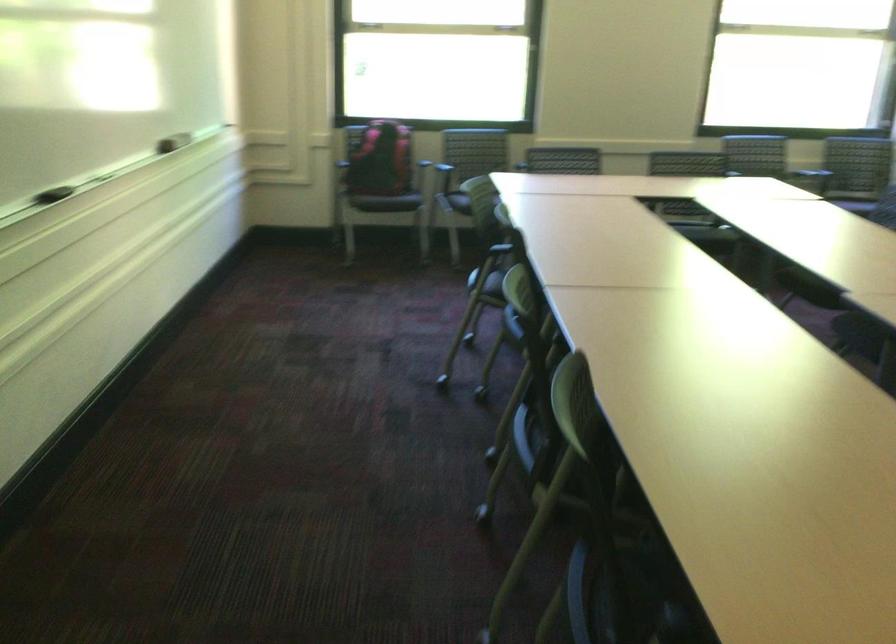
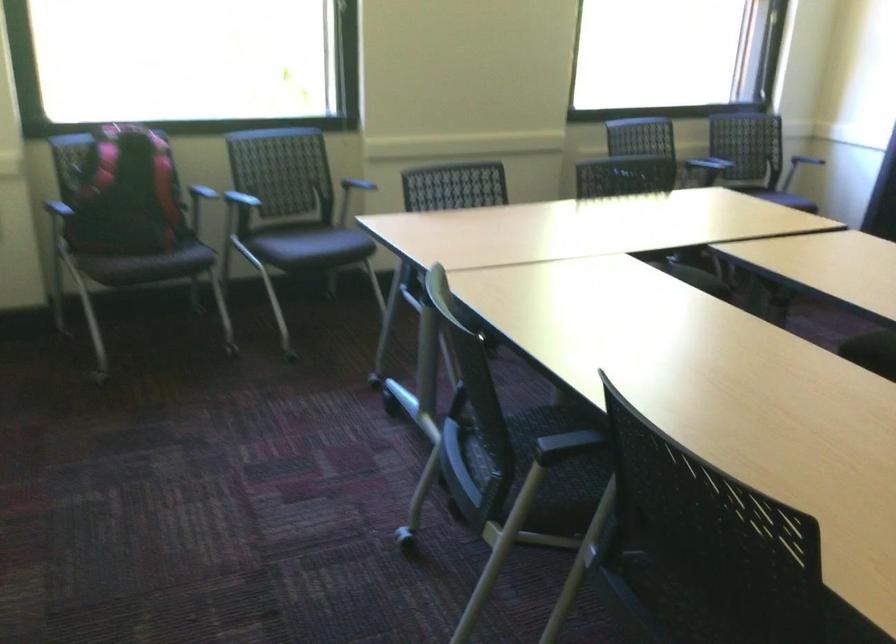
In the second image, find the point that corresponds to point 362,184 in the first image.

(124, 261)